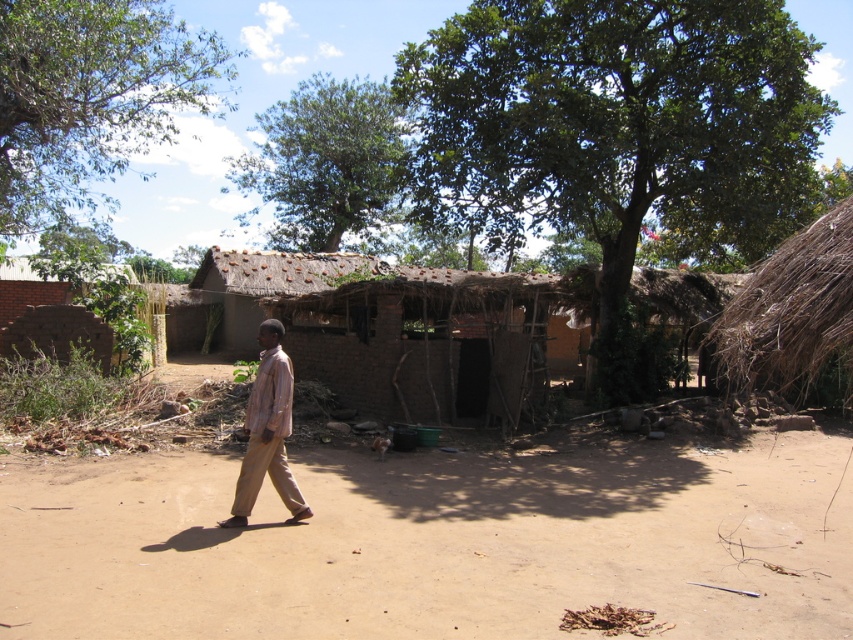
Question: Which point appears farthest from the camera in this image?

Choices:
 (A) (827, 332)
 (B) (207, 52)
 (C) (410, 582)
 (D) (291, 234)

Answer: (D)

Question: Can you confirm if brown mud hut at center is positioned below light brown fabric shirt at center?

Choices:
 (A) no
 (B) yes

Answer: (A)

Question: Is brown dirt field at center to the left of brown thatch hut at right from the viewer's perspective?

Choices:
 (A) no
 (B) yes

Answer: (B)

Question: Which of the following is the farthest from the observer?

Choices:
 (A) green leafy tree at upper left
 (B) brown thatch hut at right
 (C) light brown fabric shirt at center
 (D) brown mud hut at center

Answer: (D)

Question: Which object is farther from the camera taking this photo?

Choices:
 (A) brown mud hut at center
 (B) green leafy tree at upper center
 (C) brown thatch hut at right

Answer: (B)

Question: From the image, what is the correct spatial relationship of green leafy tree at upper left in relation to light brown fabric shirt at center?

Choices:
 (A) above
 (B) below

Answer: (A)